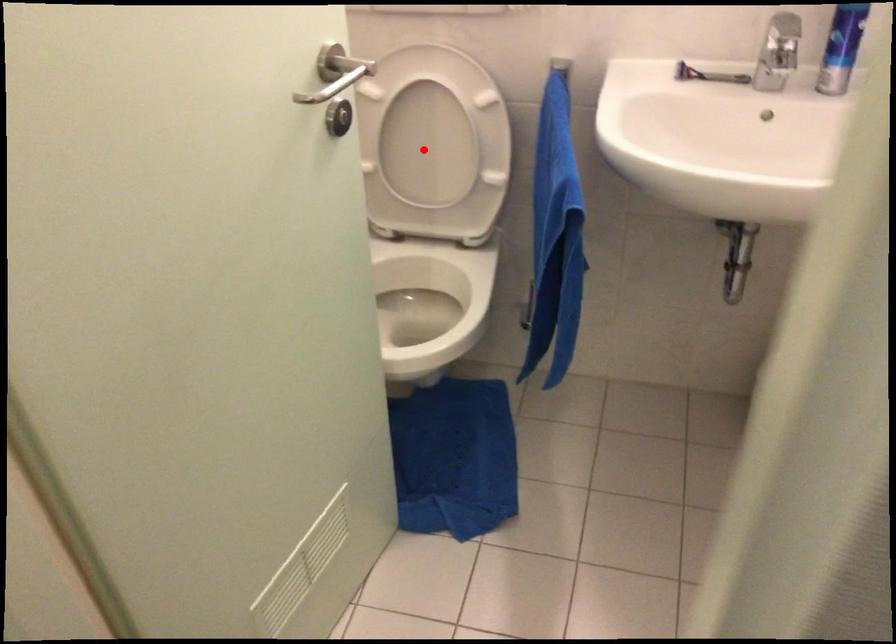
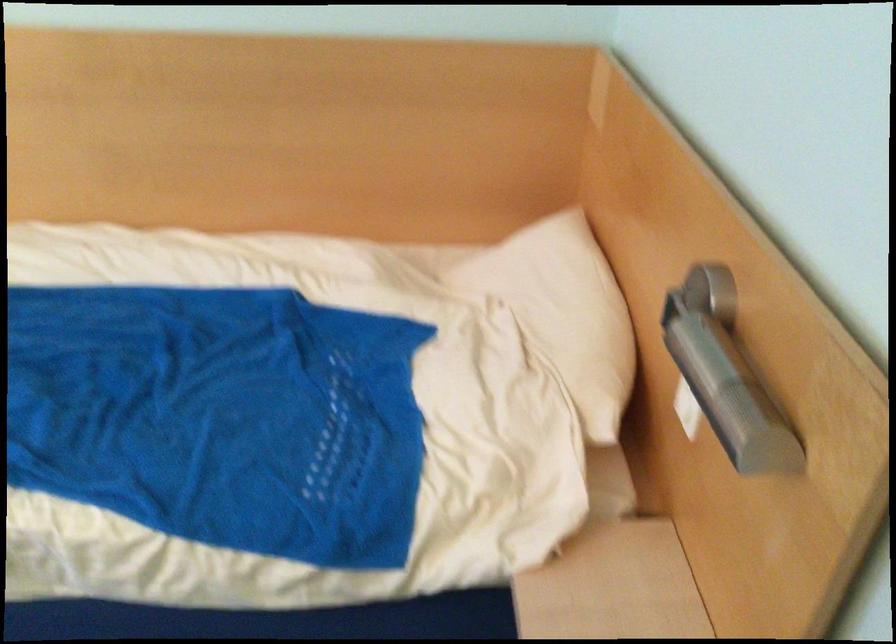
Question: I am providing you with two images of the same scene from different viewpoints. A red point is marked on the first image. At the location where the point appears in image 1, is it still visible in image 2?

Choices:
 (A) Yes
 (B) No

Answer: (B)